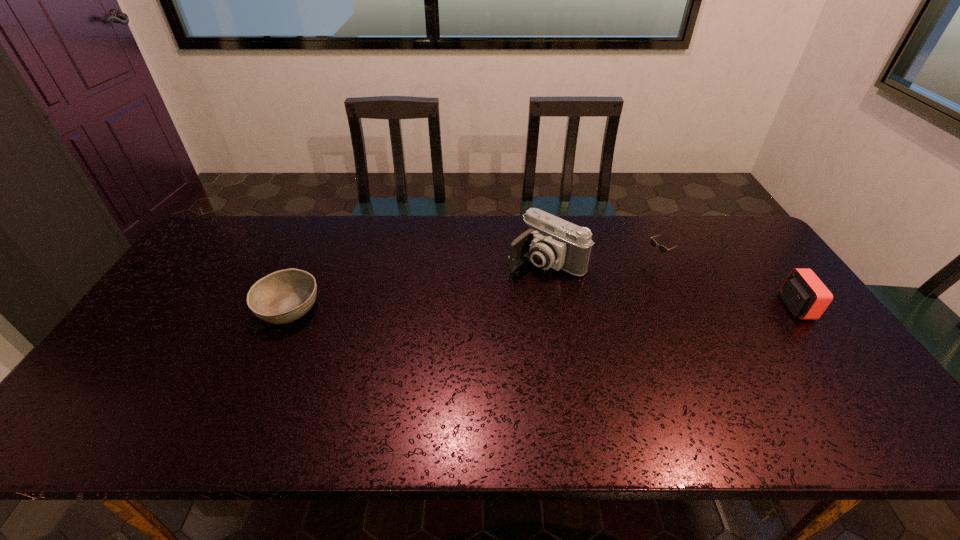
The image size is (960, 540). Find the location of `vacant space on the desktop that is between the bowl and the rightmost object and is positioned in front of the lenses of the sunglasses`. vacant space on the desktop that is between the bowl and the rightmost object and is positioned in front of the lenses of the sunglasses is located at coordinates (563, 307).

Where is `vacant space on the desktop that is between the bowl and the alarm clock and is positioned at the front of the camera with an open lens cover`? The image size is (960, 540). vacant space on the desktop that is between the bowl and the alarm clock and is positioned at the front of the camera with an open lens cover is located at coordinates (492, 308).